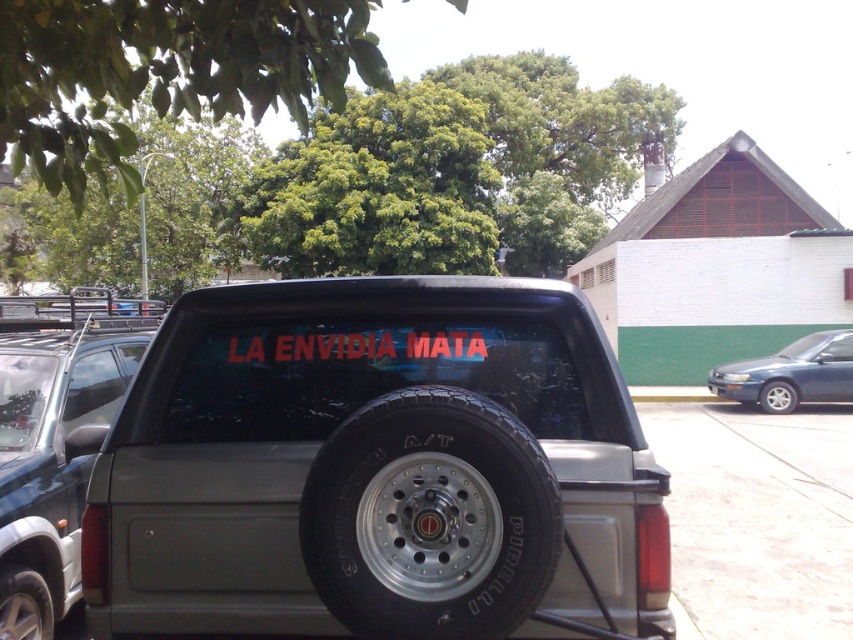
Who is higher up, black rubber tire at lower left or black rubber tire at lower right?

black rubber tire at lower left

Can you confirm if black rubber tire at lower left is bigger than black rubber tire at lower right?

Actually, black rubber tire at lower left might be smaller than black rubber tire at lower right.

Is point (16, 568) in front of point (775, 392)?

Yes, it is in front of point (775, 392).

I want to click on black rubber tire at lower left, so click(x=24, y=604).

Is metallic gray pickup truck at center smaller than satin silver suv at center?

No, metallic gray pickup truck at center is not smaller than satin silver suv at center.

Is metallic gray pickup truck at center below satin silver suv at center?

No, metallic gray pickup truck at center is not below satin silver suv at center.

This screenshot has height=640, width=853. What do you see at coordinates (374, 468) in the screenshot?
I see `metallic gray pickup truck at center` at bounding box center [374, 468].

Find the location of a particular element. metallic gray pickup truck at center is located at coordinates (374, 468).

Is point (431, 451) positioned behind point (4, 593)?

No, it is not.

Is black rubber tire at center to the right of black rubber tire at lower left from the viewer's perspective?

Correct, you'll find black rubber tire at center to the right of black rubber tire at lower left.

Is point (405, 456) positioned after point (6, 572)?

That is False.

Identify the location of black rubber tire at center. This screenshot has height=640, width=853. (430, 518).